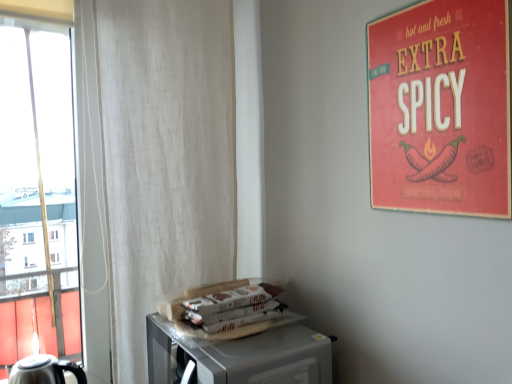
Locate an element on the screen. Image resolution: width=512 pixels, height=384 pixels. free space to the right of white paper magazine at lower center is located at coordinates (297, 321).